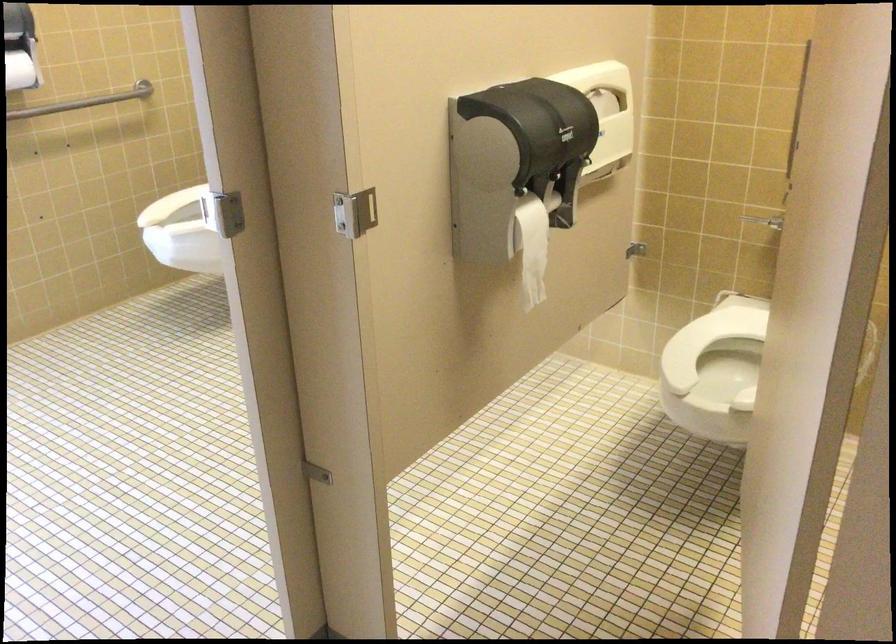
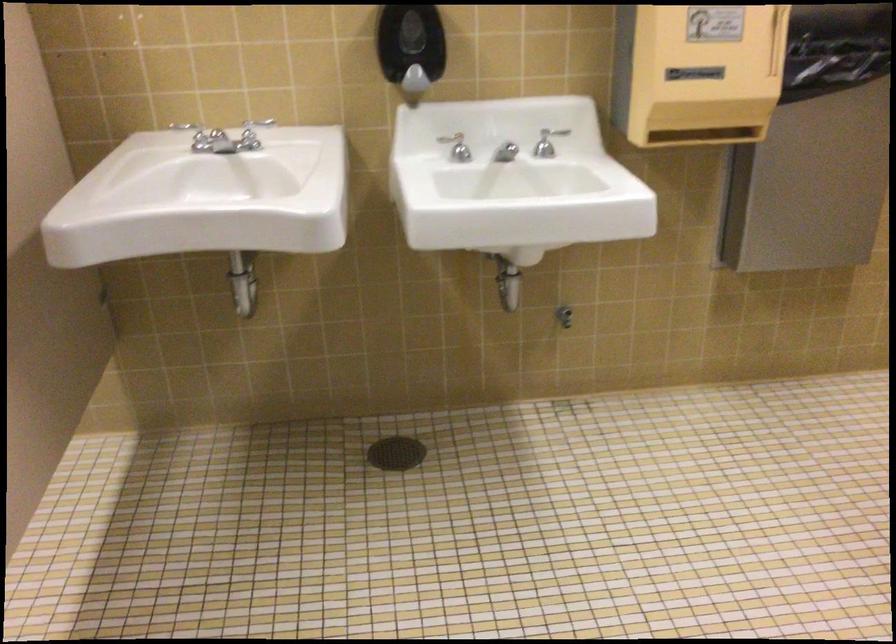
Question: The images are taken continuously from a first-person perspective. In which direction is your viewpoint rotating?

Choices:
 (A) Left
 (B) Right
 (C) Up
 (D) Down

Answer: (B)